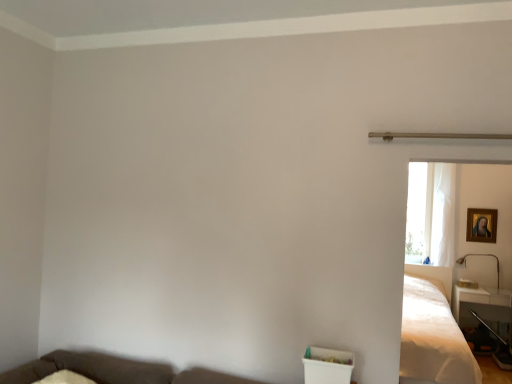
Question: Considering the relative positions of white sheer curtain at right and brown fabric couch at lower left in the image provided, is white sheer curtain at right to the left or to the right of brown fabric couch at lower left?

Choices:
 (A) right
 (B) left

Answer: (A)

Question: Which is correct: white sheer curtain at right is inside brown fabric couch at lower left, or outside of it?

Choices:
 (A) inside
 (B) outside

Answer: (B)

Question: Estimate the real-world distances between objects in this image. Which object is farther from the brown fabric couch at lower left?

Choices:
 (A) white glossy table at lower right
 (B) white satin bed at right
 (C) white sheer curtain at right
 (D) metallic gold lamp at right
 (E) gold-framed painting at upper right

Answer: (D)

Question: Which of these objects is positioned farthest from the white satin bed at right?

Choices:
 (A) white sheer curtain at right
 (B) gold-framed painting at upper right
 (C) white glossy table at lower right
 (D) metallic gold lamp at right
 (E) brown fabric couch at lower left

Answer: (E)